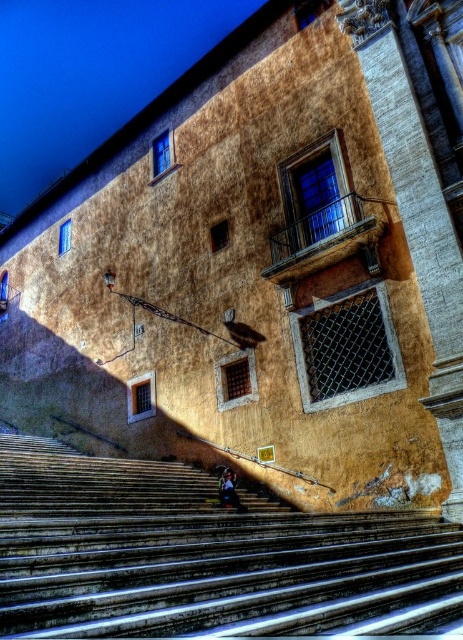
Who is more distant from viewer, (129,481) or (225,472)?

Point (225,472)

Between smooth concrete stairs at center and dark blue fabric at center, which one has more height?

With more height is smooth concrete stairs at center.

Where is `smooth concrete stairs at center`? The image size is (463, 640). smooth concrete stairs at center is located at coordinates (204, 556).

The width and height of the screenshot is (463, 640). I want to click on smooth concrete stairs at center, so click(204, 556).